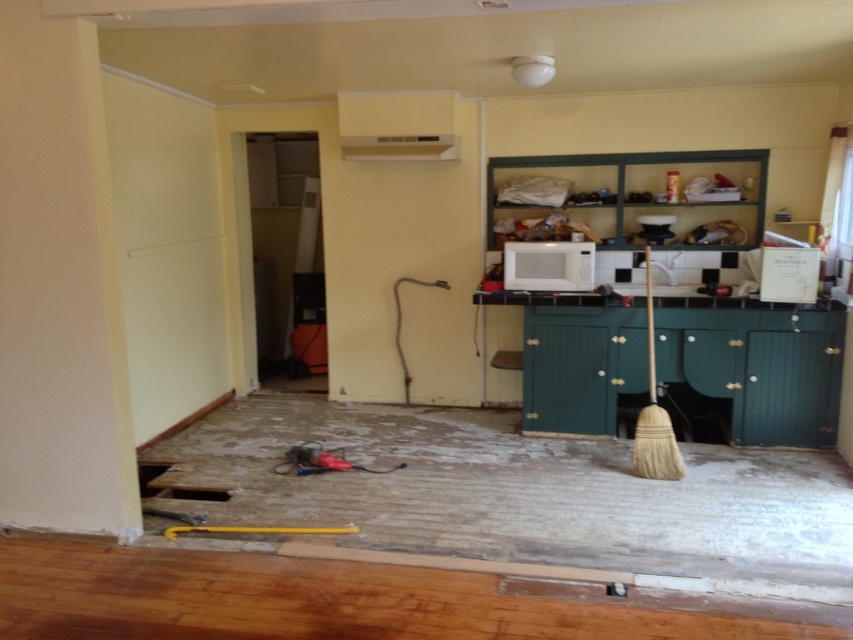
Does white matte microwave at center have a greater width compared to white matte exhaust hood at upper center?

No, white matte microwave at center is not wider than white matte exhaust hood at upper center.

I want to click on white matte microwave at center, so click(x=548, y=266).

The image size is (853, 640). I want to click on white matte microwave at center, so click(x=548, y=266).